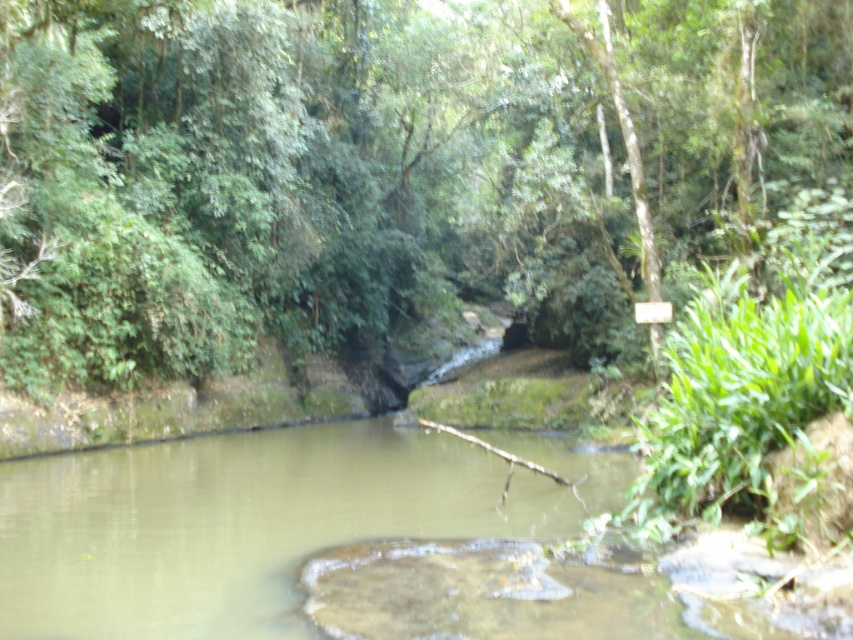
Looking at this image, can you confirm if green leafy tree at center is positioned to the right of green mossy rock at center?

Yes, green leafy tree at center is to the right of green mossy rock at center.

Between point (26, 113) and point (392, 496), which one is positioned in front?

Point (392, 496) is in front.

Identify the location of green leafy tree at center. (387, 170).